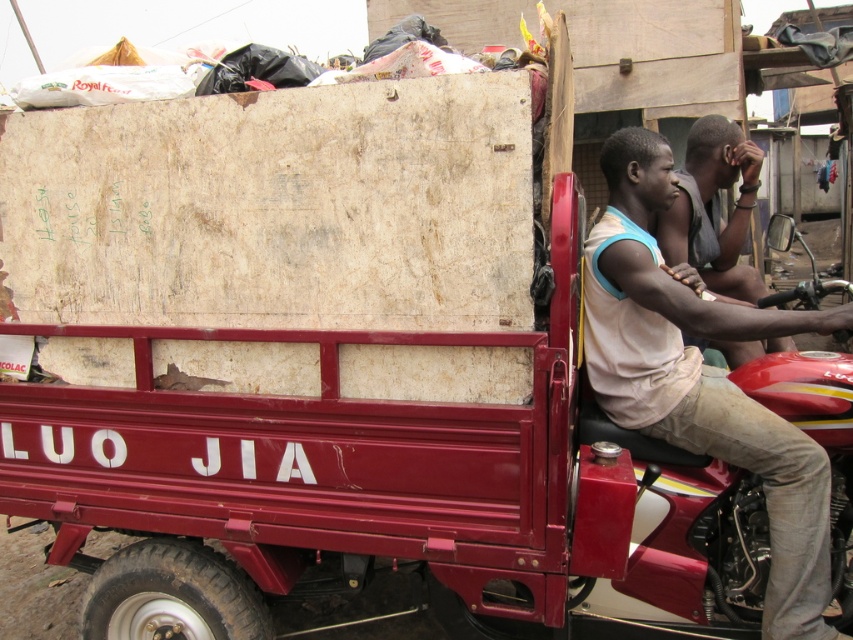
Question: Can you confirm if light beige cotton shirt at right is smaller than light brown skin at center?

Choices:
 (A) yes
 (B) no

Answer: (B)

Question: Which point appears closest to the camera in this image?

Choices:
 (A) (755, 289)
 (B) (631, 179)

Answer: (B)

Question: Does light beige cotton shirt at right have a larger size compared to light brown skin at center?

Choices:
 (A) yes
 (B) no

Answer: (A)

Question: Is light beige cotton shirt at right wider than light brown skin at center?

Choices:
 (A) no
 (B) yes

Answer: (B)

Question: Among these points, which one is farthest from the camera?

Choices:
 (A) (688, 214)
 (B) (744, 417)

Answer: (A)

Question: Which point is closer to the camera taking this photo?

Choices:
 (A) (606, 364)
 (B) (695, 128)

Answer: (A)